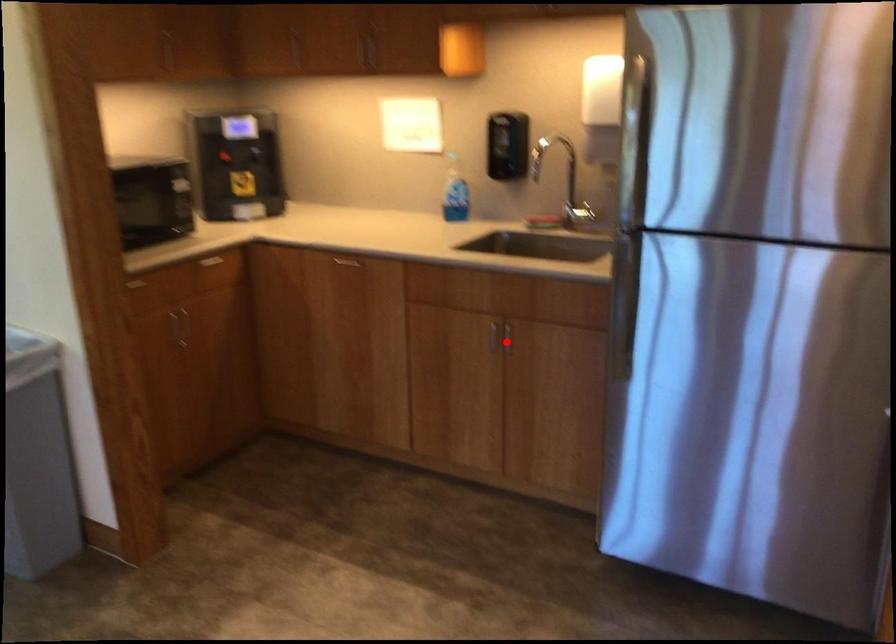
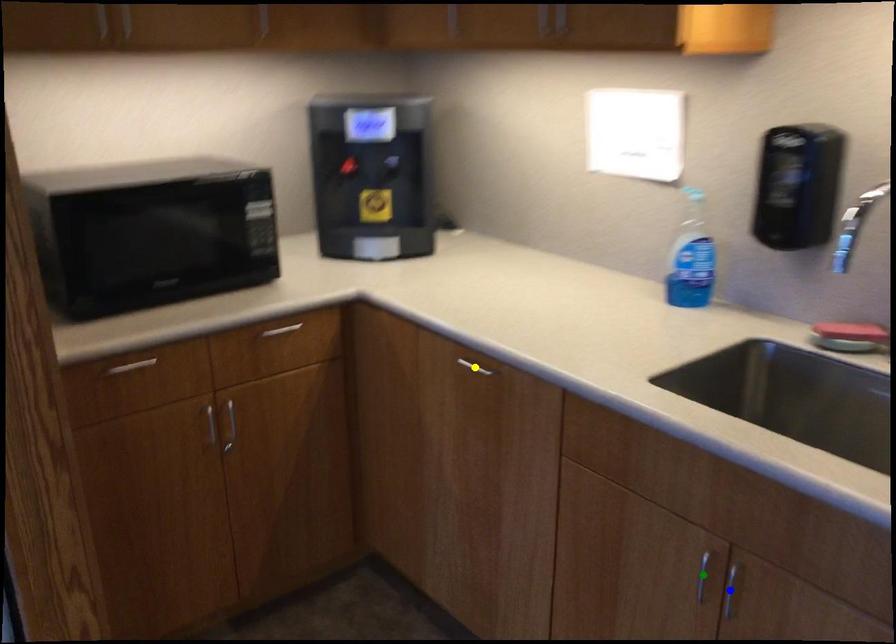
Question: I am providing you with two images of the same scene from different viewpoints. A red point is marked on the first image. You are given multiple points on the second image. In image 2, which mark is for the same physical point as the one in image 1?

Choices:
 (A) green point
 (B) blue point
 (C) yellow point

Answer: (B)